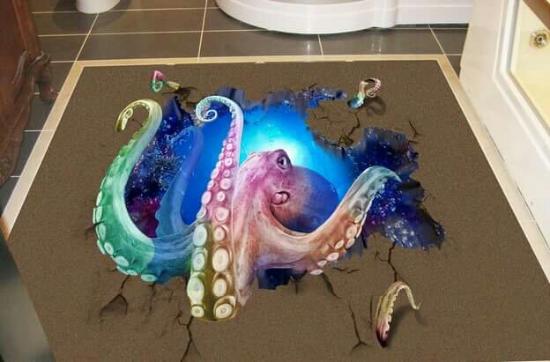
Locate an element on the screen. Image resolution: width=550 pixels, height=362 pixels. beige wall is located at coordinates tap(537, 75).